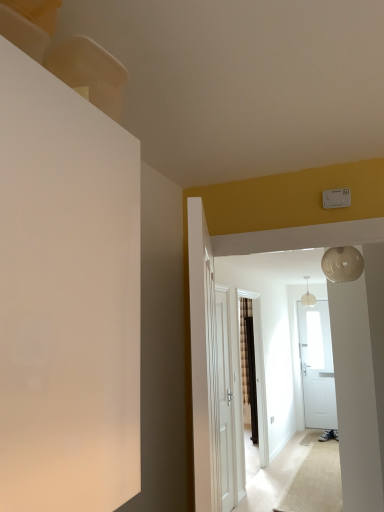
Question: Which direction should I rotate to look at white wooden door at center, marked as the 1th door in a right-to-left arrangement, — up or down?

Choices:
 (A) down
 (B) up

Answer: (A)

Question: Considering the relative positions of pearl white glass globe at upper center and white wooden door at center, which ranks as the second door in back-to-front order, in the image provided, is pearl white glass globe at upper center in front of white wooden door at center, which ranks as the second door in back-to-front order,?

Choices:
 (A) no
 (B) yes

Answer: (A)

Question: Is pearl white glass globe at upper center taller than white wooden door at center, which ranks as the second door in back-to-front order?

Choices:
 (A) no
 (B) yes

Answer: (A)

Question: Is pearl white glass globe at upper center oriented towards white wooden door at center, the 1th door when ordered from left to right?

Choices:
 (A) no
 (B) yes

Answer: (B)

Question: Is pearl white glass globe at upper center not close to white wooden door at center, which ranks as the second door in back-to-front order?

Choices:
 (A) yes
 (B) no

Answer: (A)

Question: From a real-world perspective, is pearl white glass globe at upper center beneath white wooden door at center, the 1th door when ordered from left to right?

Choices:
 (A) no
 (B) yes

Answer: (A)

Question: Can you confirm if pearl white glass globe at upper center is wider than white wooden door at center, placed as the second door when sorted from right to left?

Choices:
 (A) no
 (B) yes

Answer: (A)

Question: From the image's perspective, is white wooden door at center, which ranks as the 1th door in back-to-front order, beneath pearl white glass globe at upper right?

Choices:
 (A) yes
 (B) no

Answer: (A)

Question: Would you say white wooden door at center, the second door from the left, is outside pearl white glass globe at upper right?

Choices:
 (A) no
 (B) yes

Answer: (B)

Question: Can you confirm if white wooden door at center, the 2th door viewed from the front, is thinner than pearl white glass globe at upper right?

Choices:
 (A) yes
 (B) no

Answer: (A)

Question: Does white wooden door at center, which ranks as the 1th door in back-to-front order, lie in front of pearl white glass globe at upper right?

Choices:
 (A) yes
 (B) no

Answer: (B)

Question: Can you confirm if white wooden door at center, the 2th door viewed from the front, is positioned to the left of pearl white glass globe at upper right?

Choices:
 (A) no
 (B) yes

Answer: (B)

Question: Does white wooden door at center, the second door from the left, have a larger size compared to pearl white glass globe at upper right?

Choices:
 (A) yes
 (B) no

Answer: (A)

Question: Is pearl white glass globe at upper right a part of white wooden door at center, the 1th door when ordered from left to right?

Choices:
 (A) yes
 (B) no

Answer: (B)